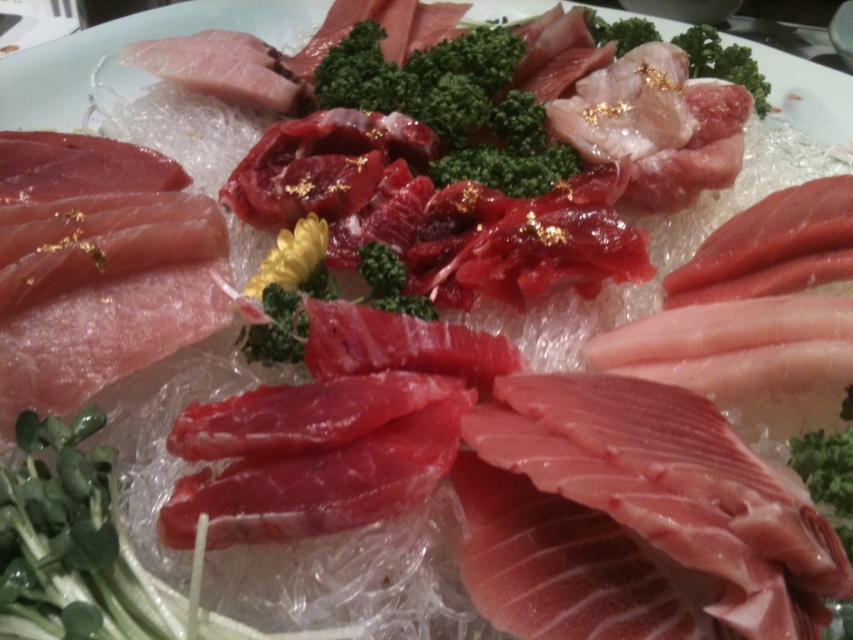
Question: Observing the image, what is the correct spatial positioning of green leafy vegetable at center in reference to green leafy broccoli at center?

Choices:
 (A) below
 (B) above

Answer: (A)

Question: Can you confirm if green leafy vegetable at center is smaller than green leafy broccoli at center?

Choices:
 (A) no
 (B) yes

Answer: (A)

Question: Which of the following is the closest to the observer?

Choices:
 (A) green leafy vegetable at center
 (B) green leafy broccoli at center

Answer: (A)

Question: Is green leafy vegetable at center closer to the viewer compared to green leafy broccoli at center?

Choices:
 (A) no
 (B) yes

Answer: (B)

Question: Which object is farther from the camera taking this photo?

Choices:
 (A) green leafy broccoli at center
 (B) green leafy vegetable at center

Answer: (A)